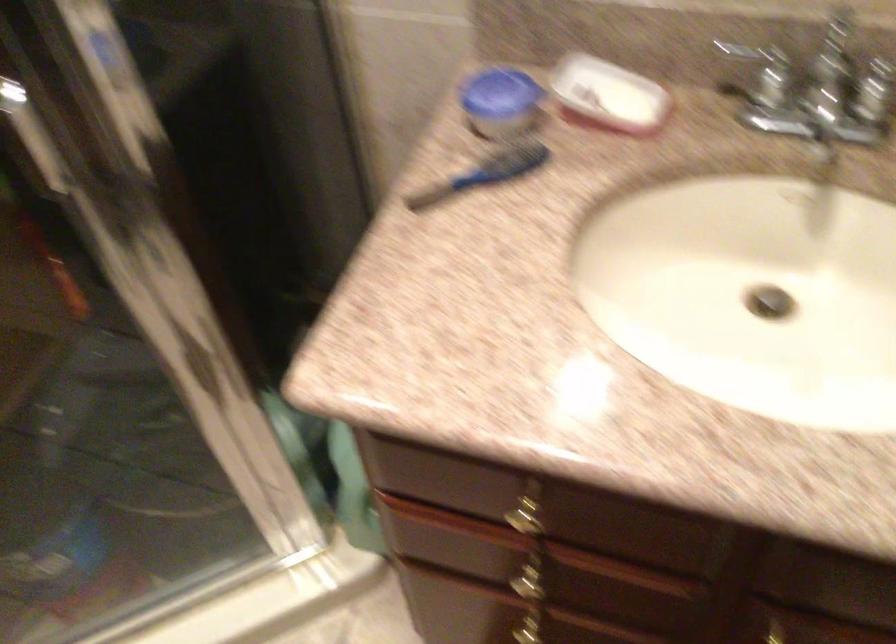
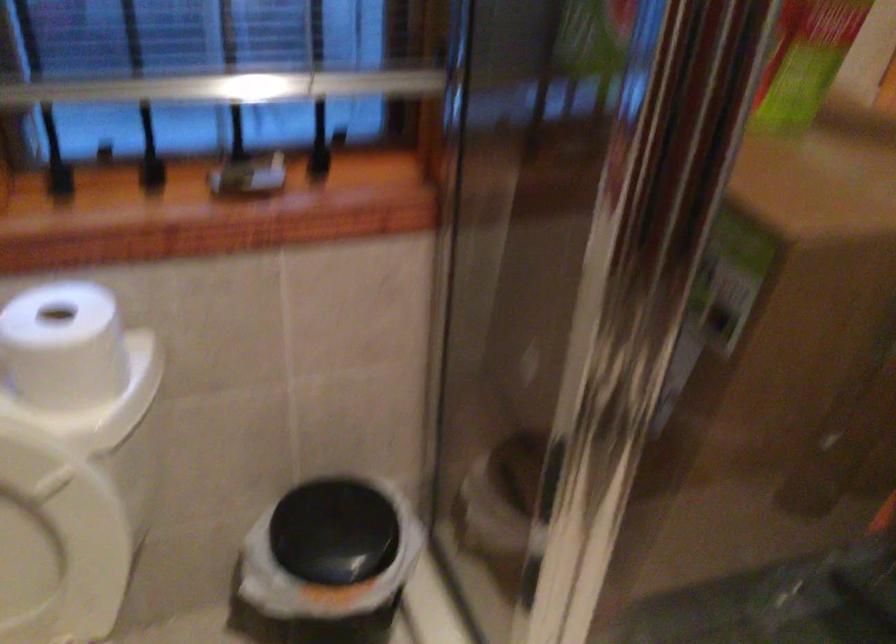
Question: The images are taken continuously from a first-person perspective. In which direction is your viewpoint rotating?

Choices:
 (A) Left
 (B) Right
 (C) Up
 (D) Down

Answer: (A)